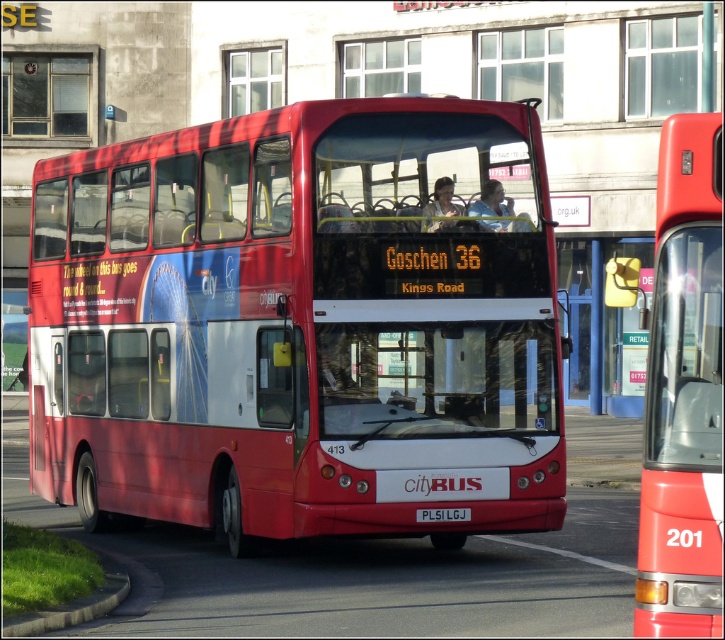
Question: Which point is closer to the camera?

Choices:
 (A) matte red bus at center
 (B) matte plastic face at center
 (C) black plastic license plate at center
 (D) shiny red bus at center

Answer: (A)

Question: Is matte red bus at center smaller than matte plastic face at center?

Choices:
 (A) yes
 (B) no

Answer: (A)

Question: Can you confirm if matte red bus at center is positioned to the right of black plastic license plate at center?

Choices:
 (A) no
 (B) yes

Answer: (B)

Question: Based on their relative distances, which object is farther from the matte plastic face at center?

Choices:
 (A) matte red bus at center
 (B) black plastic license plate at center

Answer: (A)

Question: Is matte plastic face at center bigger than black plastic license plate at center?

Choices:
 (A) yes
 (B) no

Answer: (A)

Question: Which of the following is the farthest from the observer?

Choices:
 (A) (426, 520)
 (B) (679, 600)
 (C) (439, 227)
 (D) (478, 356)

Answer: (D)